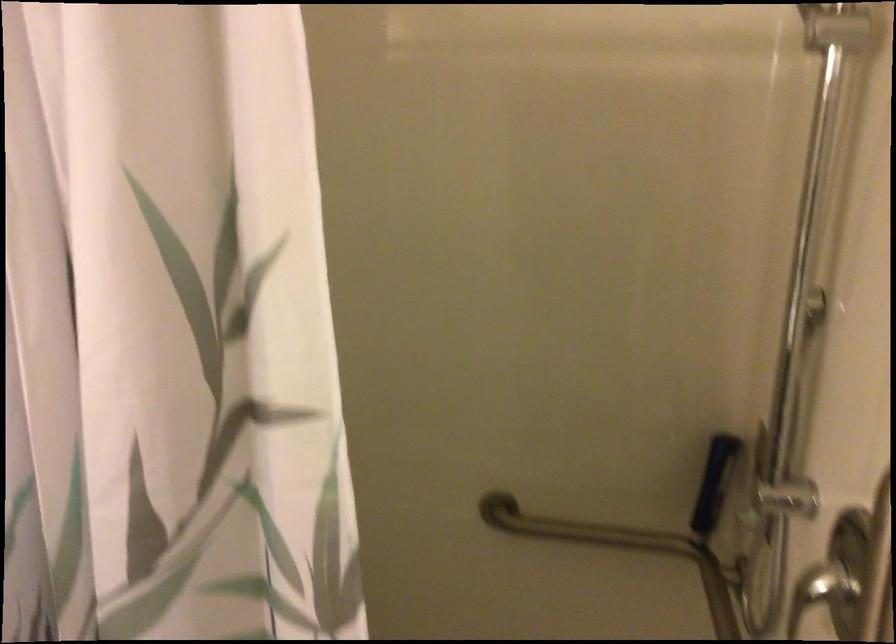
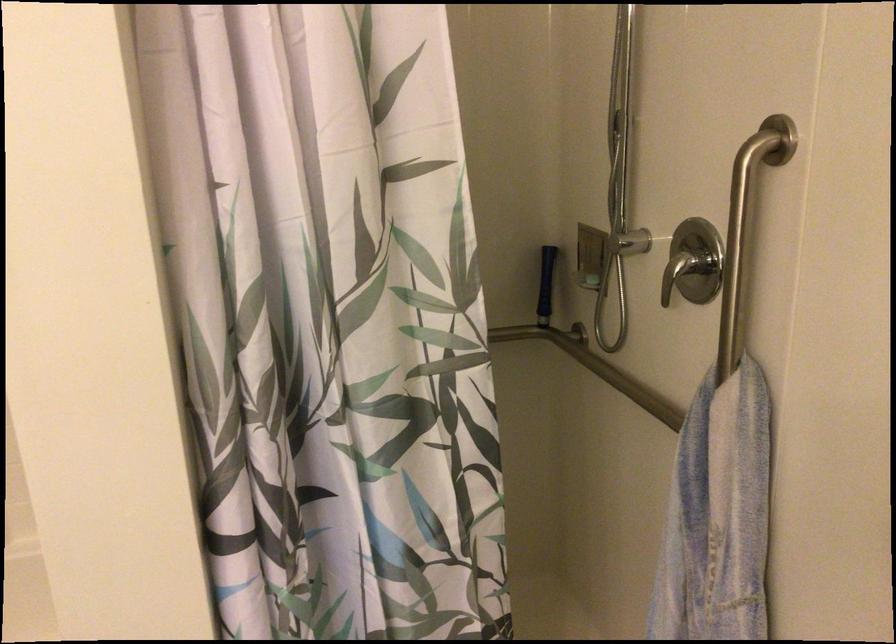
Question: I am providing you with two images of the same scene from different viewpoints. After the viewpoint changes to image2, which objects are now occluded?

Choices:
 (A) pink flower vase
 (B) metal grab bar
 (C) horizontal grab bar
 (D) vertical grab bar

Answer: (B)